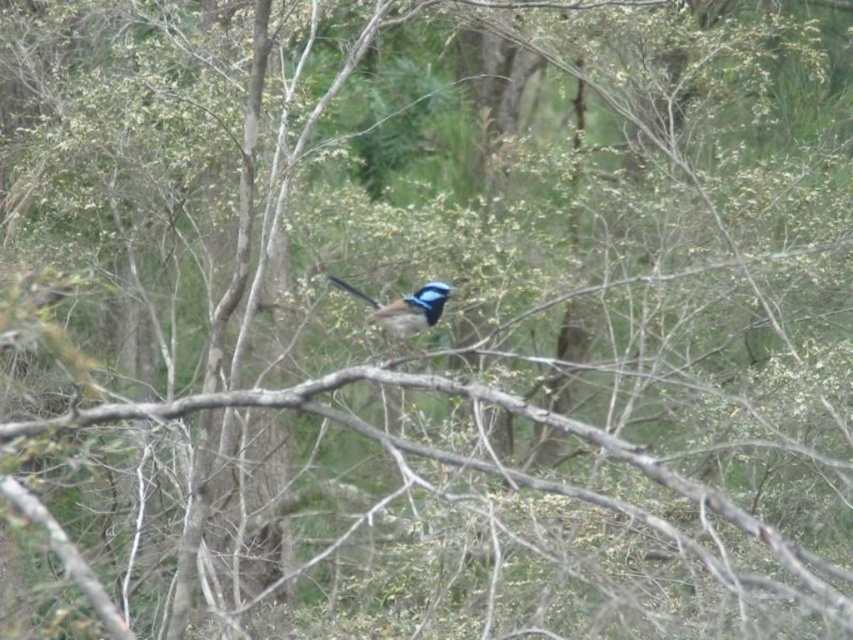
Question: Which of the following is the farthest from the observer?

Choices:
 (A) brown wood at center
 (B) blue glossy bird at center

Answer: (B)

Question: Among these objects, which one is nearest to the camera?

Choices:
 (A) blue glossy bird at center
 (B) brown wood at center

Answer: (B)

Question: Is brown wood at center thinner than blue glossy bird at center?

Choices:
 (A) yes
 (B) no

Answer: (B)

Question: Can you confirm if brown wood at center is positioned above blue glossy bird at center?

Choices:
 (A) no
 (B) yes

Answer: (A)

Question: Which point is closer to the camera?

Choices:
 (A) brown wood at center
 (B) blue glossy bird at center

Answer: (A)

Question: In this image, where is brown wood at center located relative to blue glossy bird at center?

Choices:
 (A) left
 (B) right

Answer: (B)